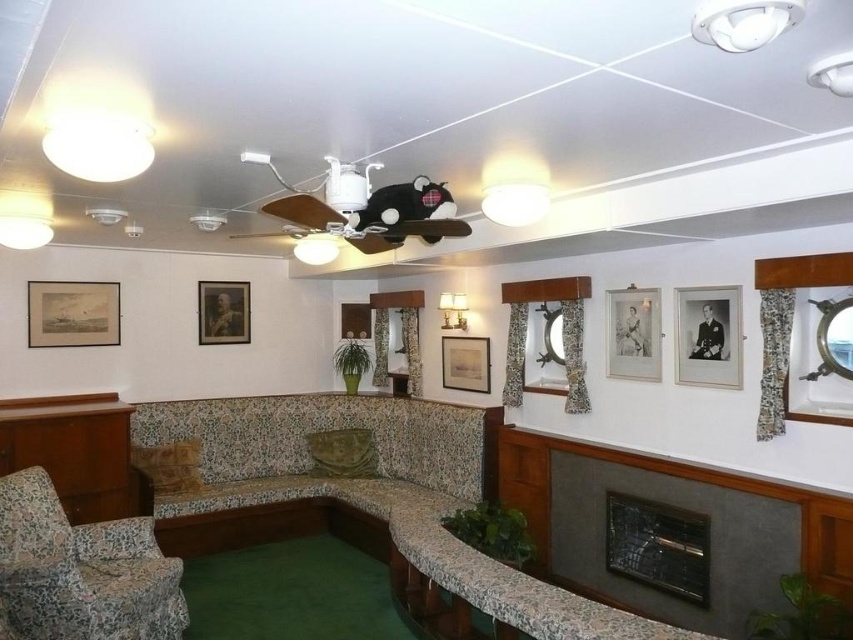
You are standing in the ship lounge and want to locate the matte paper picture frame at upper left. According to the coordinates given, where should you look relative to the center of the image?

The matte paper picture frame at upper left is located at coordinates 0.491 on the x axis and 0.086 on the y axis, so it is very close to the center of the image on the x axis but slightly above the center on the y axis.

You are an interior designer assessing the ship lounge. You notice two frames, the matte paper picture frame at upper left and the matte wooden picture frame at center. Which one has a larger height?

The matte paper picture frame at upper left has a greater height compared to the matte wooden picture frame at center.

You are planning to place a rectangular coffee table that is 1.2 meters wide in the ship lounge. The existing furniture includes the floral fabric couch at center and the wooden table at lower left. Which existing furniture piece has a greater width, and can the new coffee table fit next to it?

The floral fabric couch at center has a greater width than the wooden table at lower left. Since the new coffee table is 1.2 meters wide, it can fit next to either piece as long as there is sufficient space, but the exact placement depends on the available area around them.